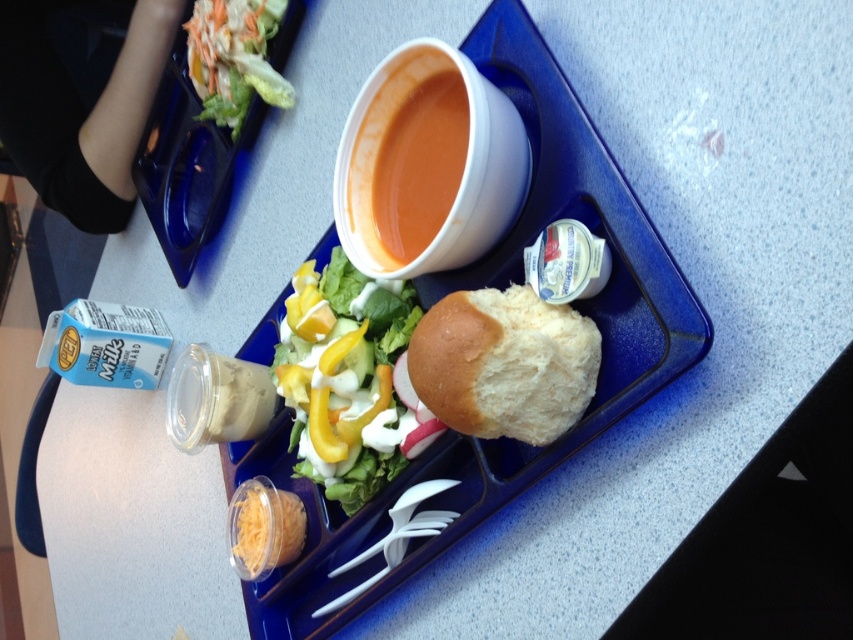
Can you confirm if fresh green salad at center is shorter than fresh green salad at upper left?

No.

Is fresh green salad at center in front of fresh green salad at upper left?

That is True.

Identify the location of fresh green salad at center. This screenshot has height=640, width=853. point(345,378).

Where is `fresh green salad at center`? fresh green salad at center is located at coordinates (345, 378).

Does point (508, 369) come closer to viewer compared to point (454, 189)?

Yes, it is.

Is point (428, 348) behind point (366, 212)?

No, (428, 348) is in front of (366, 212).

Is point (496, 358) farther from camera compared to point (453, 106)?

No.

Find the location of a particular element. The height and width of the screenshot is (640, 853). white fluffy bun at center is located at coordinates (503, 364).

Does fresh green salad at center lie in front of orange matte soup at center?

No, fresh green salad at center is further to the viewer.

Is fresh green salad at center thinner than orange matte soup at center?

Incorrect, fresh green salad at center's width is not less than orange matte soup at center's.

Who is more forward, (280, 378) or (456, 99)?

Point (456, 99)

Where is `fresh green salad at center`? This screenshot has height=640, width=853. fresh green salad at center is located at coordinates (345, 378).